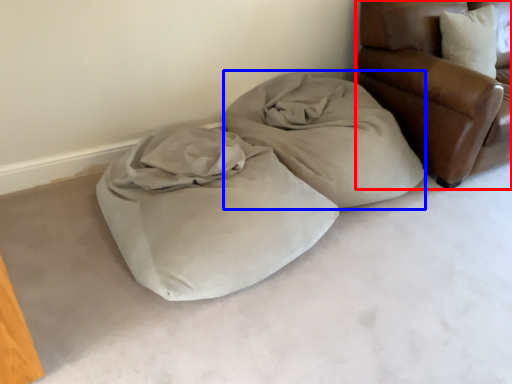
Question: Which object is further to the camera taking this photo, furniture (highlighted by a red box) or cloth (highlighted by a blue box)?

Choices:
 (A) furniture
 (B) cloth

Answer: (B)